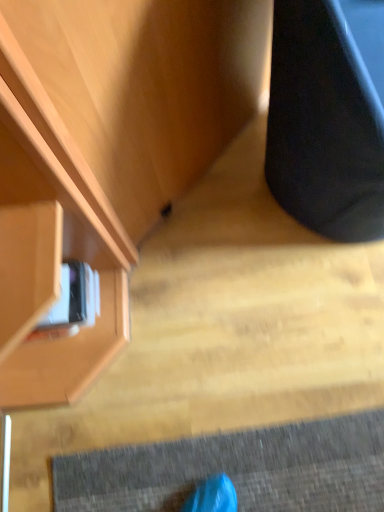
Question: From their relative heights in the image, would you say black matte speaker at right is taller or shorter than matte wood cabinet at upper left?

Choices:
 (A) short
 (B) tall

Answer: (B)

Question: Considering the positions of black matte speaker at right and matte wood cabinet at upper left in the image, is black matte speaker at right wider or thinner than matte wood cabinet at upper left?

Choices:
 (A) thin
 (B) wide

Answer: (A)

Question: Considering the positions of point (367, 167) and point (36, 8), is point (367, 167) closer or farther from the camera than point (36, 8)?

Choices:
 (A) closer
 (B) farther

Answer: (B)

Question: Relative to black matte speaker at right, is matte wood cabinet at upper left in front or behind?

Choices:
 (A) behind
 (B) front

Answer: (A)

Question: Is matte wood cabinet at upper left taller or shorter than black matte speaker at right?

Choices:
 (A) short
 (B) tall

Answer: (A)

Question: Is point (11, 361) closer or farther from the camera than point (271, 97)?

Choices:
 (A) farther
 (B) closer

Answer: (A)

Question: Is matte wood cabinet at upper left to the left or to the right of black matte speaker at right in the image?

Choices:
 (A) right
 (B) left

Answer: (B)